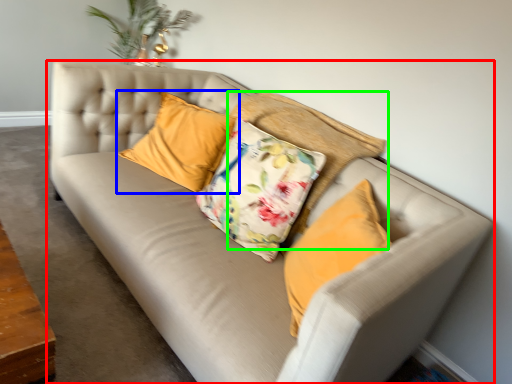
Question: Which object is the farthest from studio couch (highlighted by a red box)? Choose among these: pillow (highlighted by a blue box) or pillow (highlighted by a green box).

Choices:
 (A) pillow
 (B) pillow

Answer: (B)